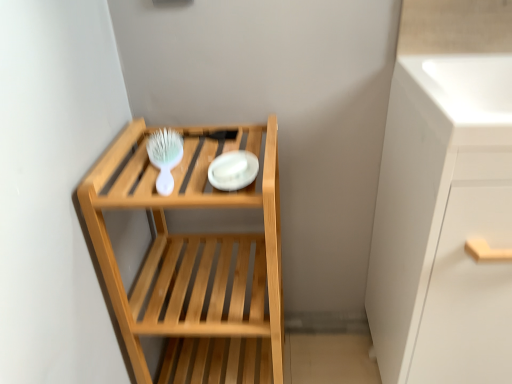
Question: Is white glossy cabinet at right beside white glossy sink at upper right?

Choices:
 (A) yes
 (B) no

Answer: (B)

Question: From a real-world perspective, is white glossy cabinet at right on top of white glossy sink at upper right?

Choices:
 (A) no
 (B) yes

Answer: (A)

Question: From a real-world perspective, is white glossy cabinet at right physically below white glossy sink at upper right?

Choices:
 (A) no
 (B) yes

Answer: (B)

Question: Does white glossy cabinet at right have a greater height compared to white glossy sink at upper right?

Choices:
 (A) yes
 (B) no

Answer: (A)

Question: Is white glossy sink at upper right at the back of white glossy cabinet at right?

Choices:
 (A) yes
 (B) no

Answer: (B)

Question: Based on their positions, is white glossy plate at center located to the left or right of white plastic brush at upper left?

Choices:
 (A) left
 (B) right

Answer: (B)

Question: Is white glossy plate at center taller or shorter than white plastic brush at upper left?

Choices:
 (A) tall
 (B) short

Answer: (B)

Question: Is white glossy plate at center bigger or smaller than white plastic brush at upper left?

Choices:
 (A) small
 (B) big

Answer: (A)

Question: Considering the positions of white glossy plate at center and white plastic brush at upper left in the image, is white glossy plate at center wider or thinner than white plastic brush at upper left?

Choices:
 (A) wide
 (B) thin

Answer: (B)

Question: From the image's perspective, relative to white plastic brush at upper left, is white glossy sink at upper right above or below?

Choices:
 (A) above
 (B) below

Answer: (A)

Question: Considering the positions of white glossy sink at upper right and white plastic brush at upper left in the image, is white glossy sink at upper right taller or shorter than white plastic brush at upper left?

Choices:
 (A) short
 (B) tall

Answer: (B)

Question: Does point (508, 72) appear closer or farther from the camera than point (152, 152)?

Choices:
 (A) farther
 (B) closer

Answer: (B)

Question: From a real-world perspective, is white glossy sink at upper right physically located above or below white plastic brush at upper left?

Choices:
 (A) above
 (B) below

Answer: (A)

Question: Is natural wood shelf at center taller or shorter than white glossy plate at center?

Choices:
 (A) short
 (B) tall

Answer: (B)

Question: Looking at the image, does natural wood shelf at center seem bigger or smaller compared to white glossy plate at center?

Choices:
 (A) small
 (B) big

Answer: (B)